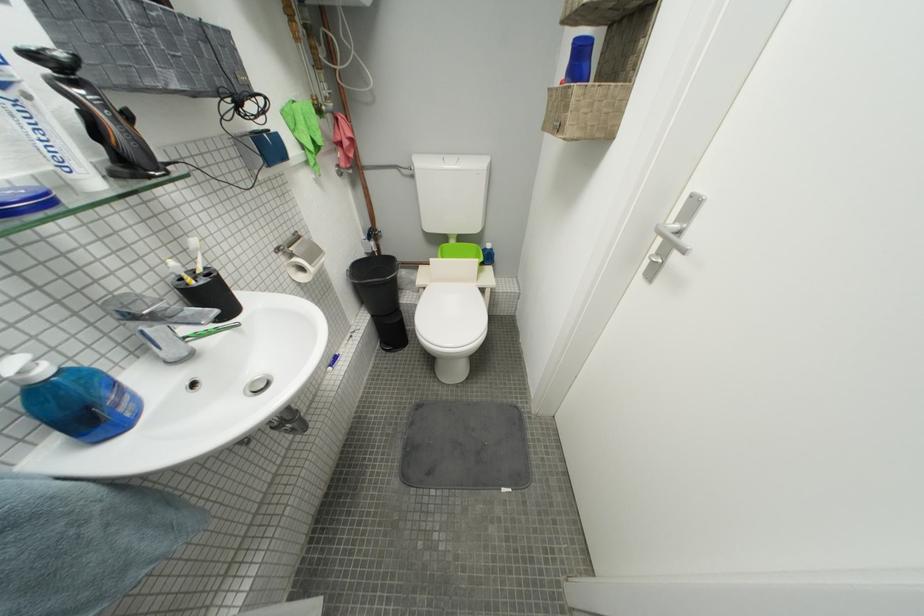
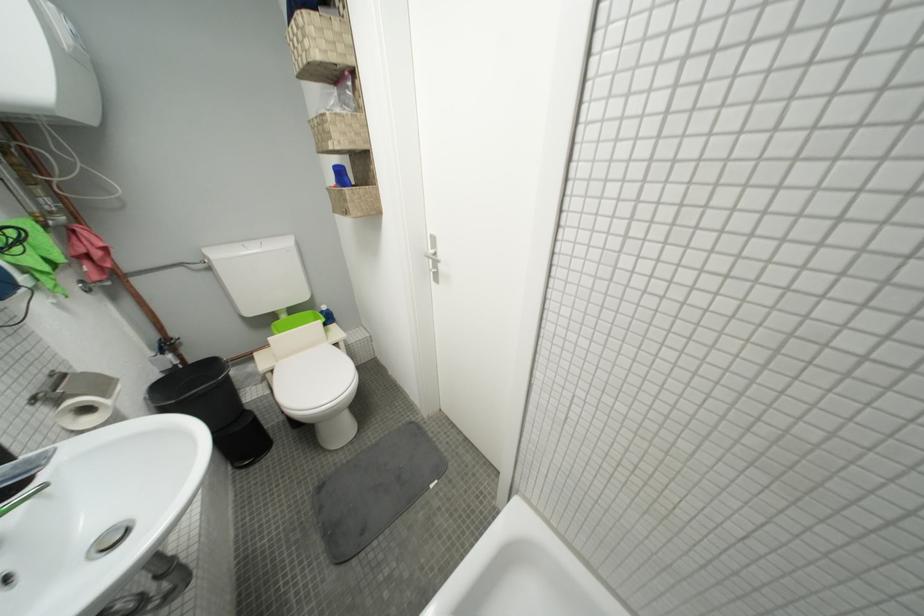
Locate, in the second image, the point that corresponds to point 382,236 in the first image.

(175, 347)